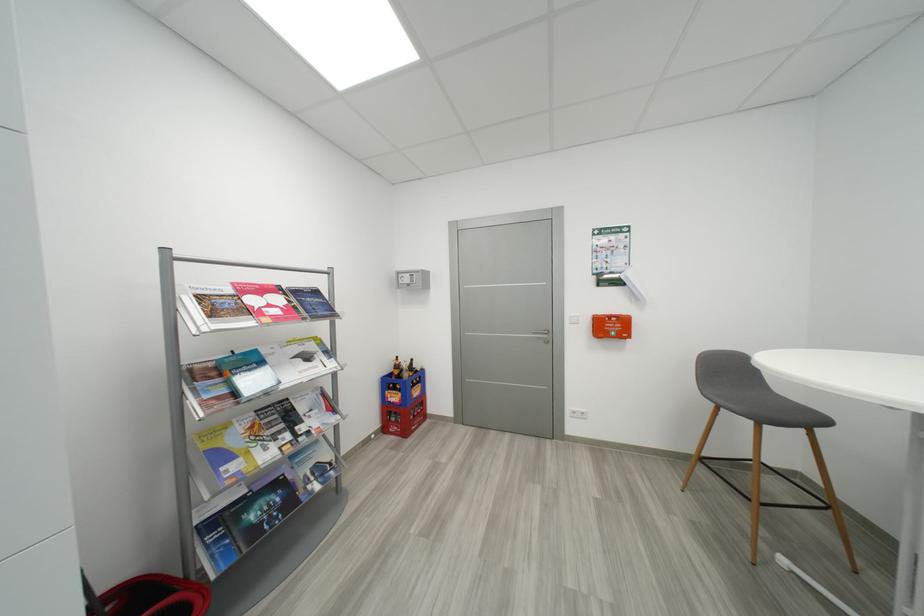
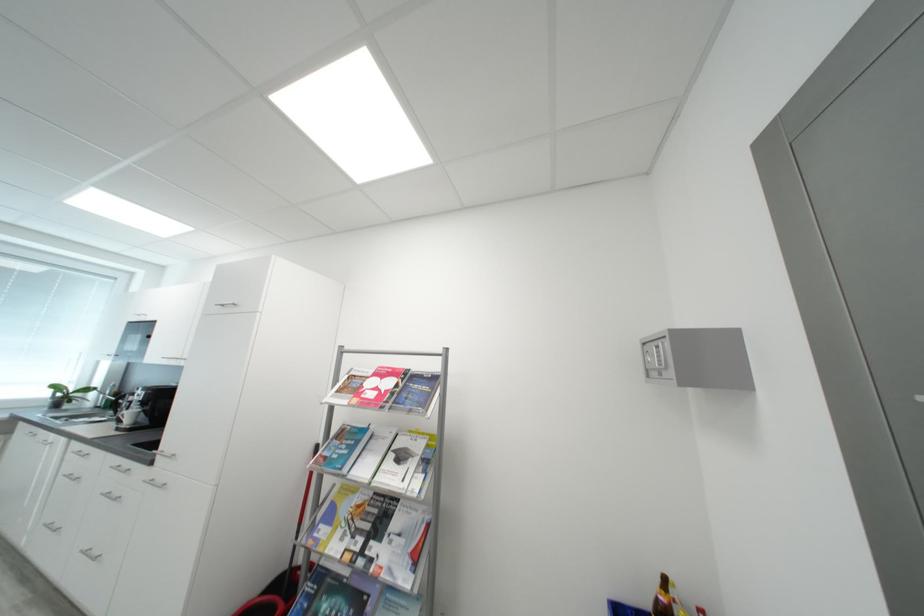
Find the pixel in the second image that matches point 286,310 in the first image.

(383, 395)